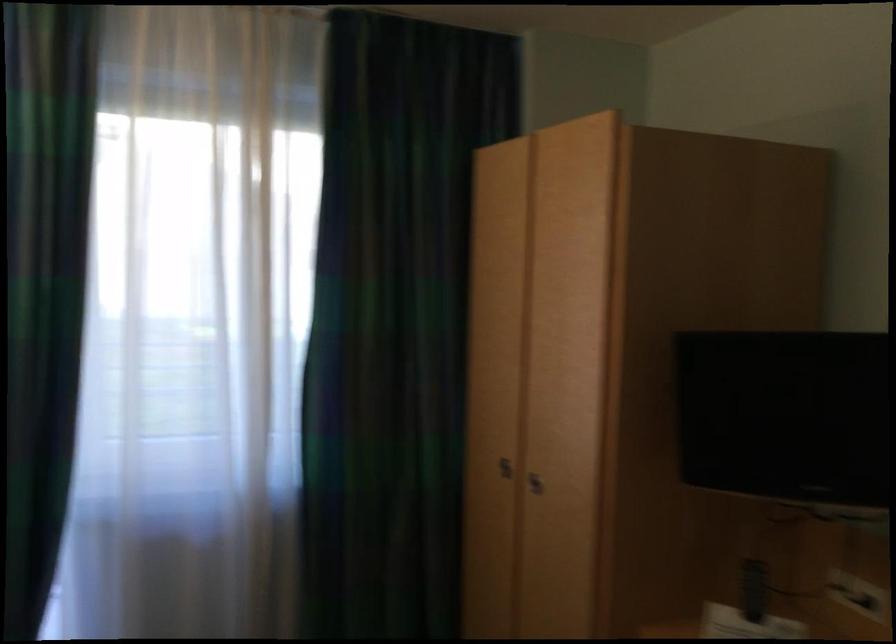
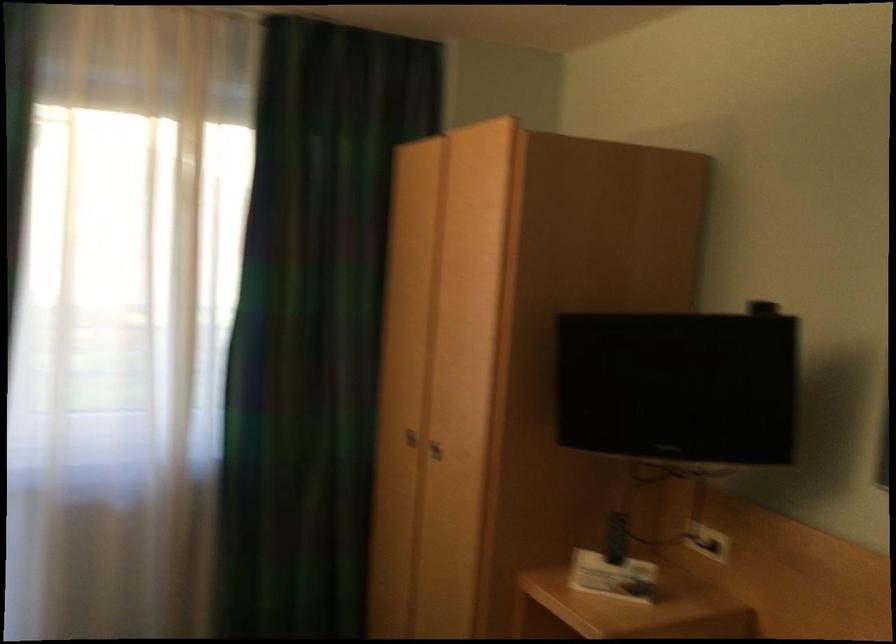
Find the pixel in the second image that matches (501,466) in the first image.

(409, 438)